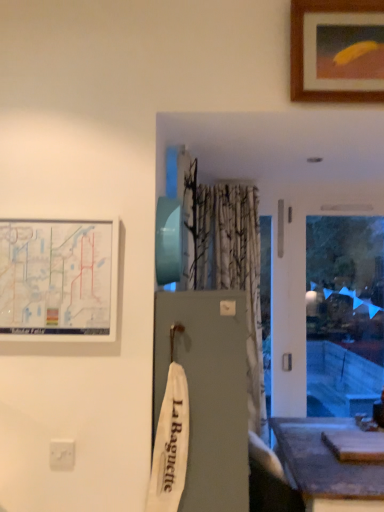
Question: Relative to white matte map at upper left, placed as the 1th picture frame when sorted from left to right, is white plastic electric outlet at lower left in front or behind?

Choices:
 (A) behind
 (B) front

Answer: (A)

Question: Considering the positions of white plastic electric outlet at lower left and white matte map at upper left, marked as the 1th picture frame in a bottom-to-top arrangement, in the image, is white plastic electric outlet at lower left taller or shorter than white matte map at upper left, marked as the 1th picture frame in a bottom-to-top arrangement,?

Choices:
 (A) short
 (B) tall

Answer: (A)

Question: Based on their relative distances, which object is farther from the smooth gray table at lower right?

Choices:
 (A) white plastic electric outlet at lower left
 (B) white matte map at upper left, which is counted as the 2th picture frame, starting from the top
 (C) wooden picture frame at upper right, marked as the first picture frame in a top-to-bottom arrangement

Answer: (C)

Question: Considering the real-world distances, which object is closest to the smooth gray table at lower right?

Choices:
 (A) wooden picture frame at upper right, the first picture frame viewed from the right
 (B) white matte map at upper left, marked as the 1th picture frame in a bottom-to-top arrangement
 (C) white plastic electric outlet at lower left

Answer: (C)